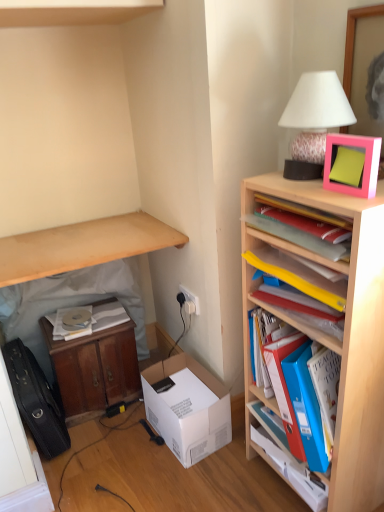
Question: Does white cardboard box at lower center have a greater height compared to white matte table lamp at upper right?

Choices:
 (A) no
 (B) yes

Answer: (A)

Question: From the image's perspective, is white cardboard box at lower center located above white matte table lamp at upper right?

Choices:
 (A) yes
 (B) no

Answer: (B)

Question: Is white cardboard box at lower center at the right side of white matte table lamp at upper right?

Choices:
 (A) yes
 (B) no

Answer: (B)

Question: Does white cardboard box at lower center come in front of white matte table lamp at upper right?

Choices:
 (A) yes
 (B) no

Answer: (B)

Question: Does white cardboard box at lower center have a lesser height compared to white matte table lamp at upper right?

Choices:
 (A) no
 (B) yes

Answer: (B)

Question: Is white cardboard box at lower center bigger than white matte table lamp at upper right?

Choices:
 (A) no
 (B) yes

Answer: (B)

Question: Does blue plastic cabinet at right have a larger size compared to light wood shelf at upper left?

Choices:
 (A) yes
 (B) no

Answer: (B)

Question: Is the depth of blue plastic cabinet at right greater than that of light wood shelf at upper left?

Choices:
 (A) yes
 (B) no

Answer: (B)

Question: Is blue plastic cabinet at right looking in the opposite direction of light wood shelf at upper left?

Choices:
 (A) yes
 (B) no

Answer: (B)

Question: Are blue plastic cabinet at right and light wood shelf at upper left located far from each other?

Choices:
 (A) no
 (B) yes

Answer: (A)

Question: From the image's perspective, is blue plastic cabinet at right above light wood shelf at upper left?

Choices:
 (A) yes
 (B) no

Answer: (B)

Question: Is blue plastic cabinet at right wider than light wood shelf at upper left?

Choices:
 (A) no
 (B) yes

Answer: (A)

Question: Is wooden bookshelf at right, placed as the 2th shelf when sorted from top to bottom, taller than white paper at lower left, which ranks as the second book in front-to-back order?

Choices:
 (A) yes
 (B) no

Answer: (A)